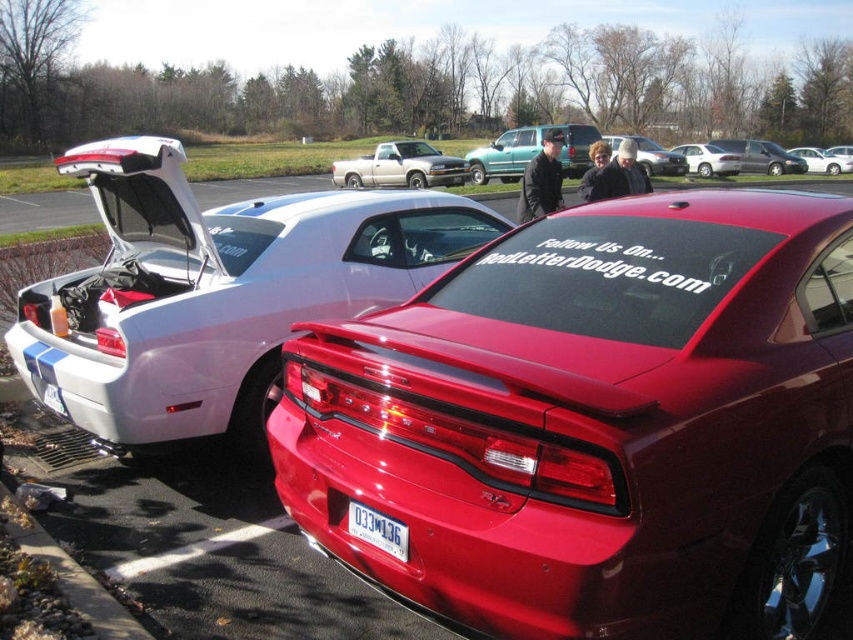
Does white glossy car at left come behind metallic silver truck at center?

No, it is in front of metallic silver truck at center.

Does white glossy car at left have a greater height compared to metallic silver truck at center?

Incorrect, white glossy car at left's height is not larger of metallic silver truck at center's.

Image resolution: width=853 pixels, height=640 pixels. Identify the location of white glossy car at left. (213, 291).

Image resolution: width=853 pixels, height=640 pixels. In order to click on white glossy car at left in this screenshot , I will do `click(213, 291)`.

In the scene shown: Measure the distance between white glossy car at center and camera.

white glossy car at center is 52.53 feet away from camera.

Between white glossy car at center and matte black car at center, which one appears on the right side from the viewer's perspective?

matte black car at center

In the scene shown: Who is more forward, (509, 200) or (618, 150)?

Point (618, 150)

You are a GUI agent. You are given a task and a screenshot of the screen. Output one action in this format:
    pyautogui.click(x=<x>, y=<y>)
    Task: Click on the white glossy car at center
    The image size is (853, 640).
    Given the screenshot: What is the action you would take?
    pyautogui.click(x=45, y=211)

Can you confirm if shiny red car at center is positioned below metallic silver truck at center?

Yes, shiny red car at center is below metallic silver truck at center.

Is shiny red car at center wider than metallic silver truck at center?

No.

Which is in front, point (601, 360) or point (335, 170)?

Point (601, 360) is in front.

This screenshot has height=640, width=853. Find the location of `shiny red car at center`. shiny red car at center is located at coordinates (596, 422).